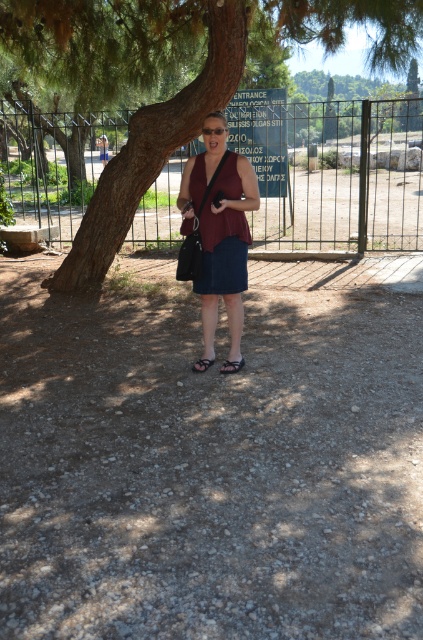
Question: Which object is positioned closest to the matte black shoulder bag at center?

Choices:
 (A) matte red blouse at center
 (B) black leather sandal at lower center
 (C) green leafy tree at center

Answer: (A)

Question: Is matte black shoulder bag at center to the right of black rubber sandal at lower center from the viewer's perspective?

Choices:
 (A) yes
 (B) no

Answer: (B)

Question: Can you confirm if black leather sandal at lower center is wider than black rubber sandal at lower center?

Choices:
 (A) no
 (B) yes

Answer: (B)

Question: Based on their relative distances, which object is farther from the matte black shoulder bag at center?

Choices:
 (A) matte red blouse at center
 (B) black rubber sandal at lower center
 (C) green leafy tree at center

Answer: (C)

Question: Is green leafy tree at center to the left of matte black shoulder bag at center from the viewer's perspective?

Choices:
 (A) no
 (B) yes

Answer: (B)

Question: Which point is farther to the camera?

Choices:
 (A) (200, 364)
 (B) (233, 364)
 (C) (208, 195)

Answer: (A)